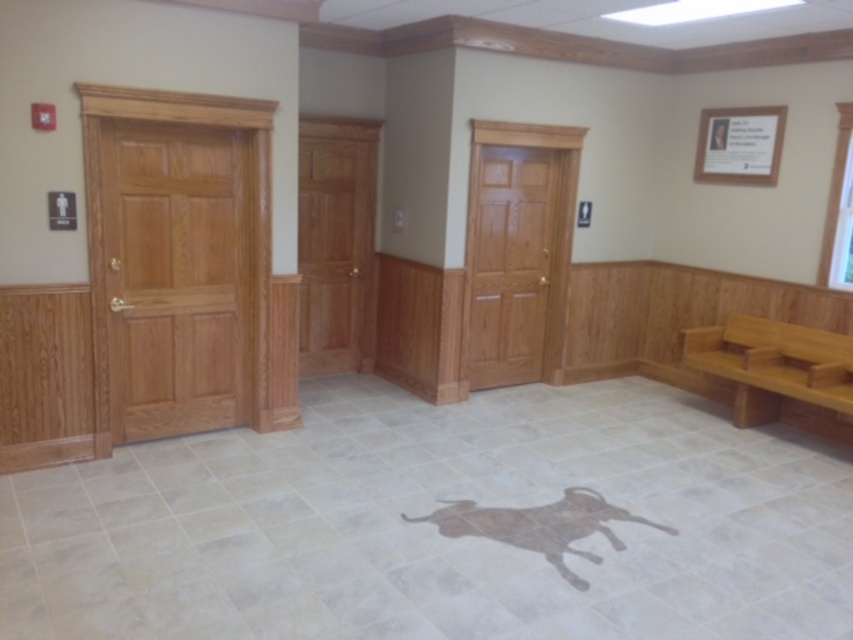
You are a painter assigned to paint all the doors in the hallway. You have a ladder that can reach up to 2 meters. The height of the light oak wood door at center is 1.8 meters. Can you paint the light brown wood door at left without needing a taller ladder?

The light brown wood door at left is taller than the light oak wood door at center. Since the light oak wood door at center is 1.8 meters tall, the light brown wood door at left is taller than 1.8 meters. The ladder can only reach up to 2 meters, so if the light brown wood door at left is less than or equal to 2 meters tall, you can paint it. However, if it exceeds 2 meters, you would need a taller ladder. The exact height isn

You are a maintenance worker needing to move a 4.0 meter long pipe from the brown wooden bench at lower right to the light brown wood door at left. Can you move it without bending the pipe?

The distance between the light brown wood door at left and the brown wooden bench at lower right is 3.90 meters. Since the pipe is 4.0 meters long, it is slightly longer than the available space. Therefore, you will need to bend the pipe to move it through the space.